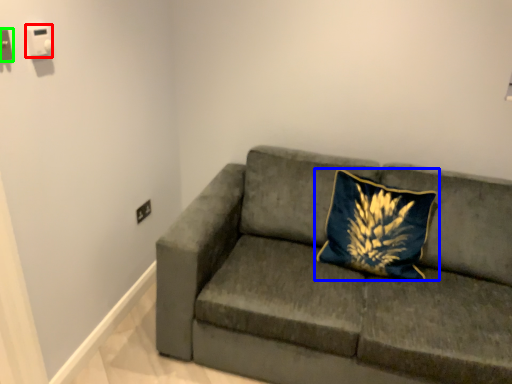
Question: Considering the real-world distances, which object is farthest from electric outlet (highlighted by a red box)? pillow (highlighted by a blue box) or electric outlet (highlighted by a green box)?

Choices:
 (A) pillow
 (B) electric outlet

Answer: (A)